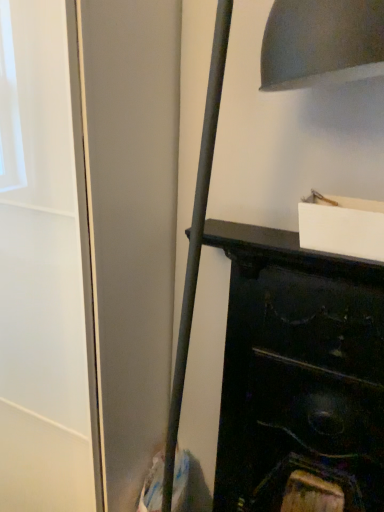
Describe the element at coordinates (298, 371) in the screenshot. This screenshot has height=512, width=384. I see `black glossy chest of drawers at center` at that location.

Identify the location of black glossy chest of drawers at center. The width and height of the screenshot is (384, 512). (298, 371).

Locate an element on the screen. The image size is (384, 512). black glossy chest of drawers at center is located at coordinates (298, 371).